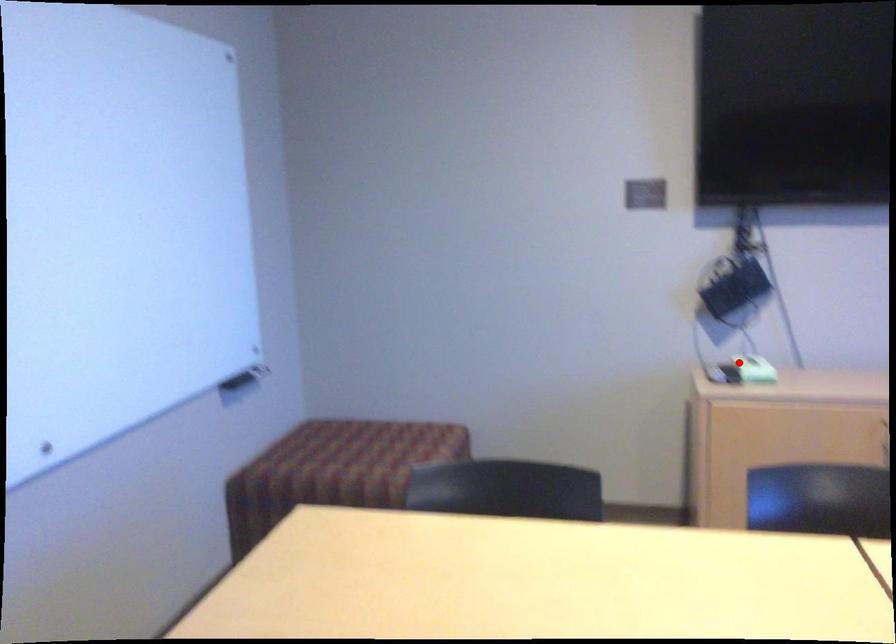
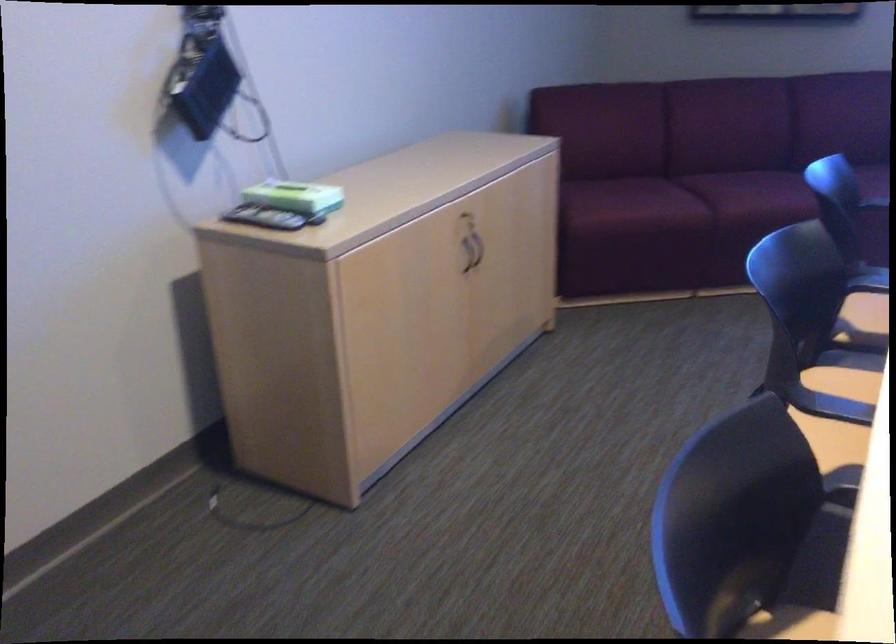
Find the pixel in the second image that matches the highlighted location in the first image.

(287, 196)